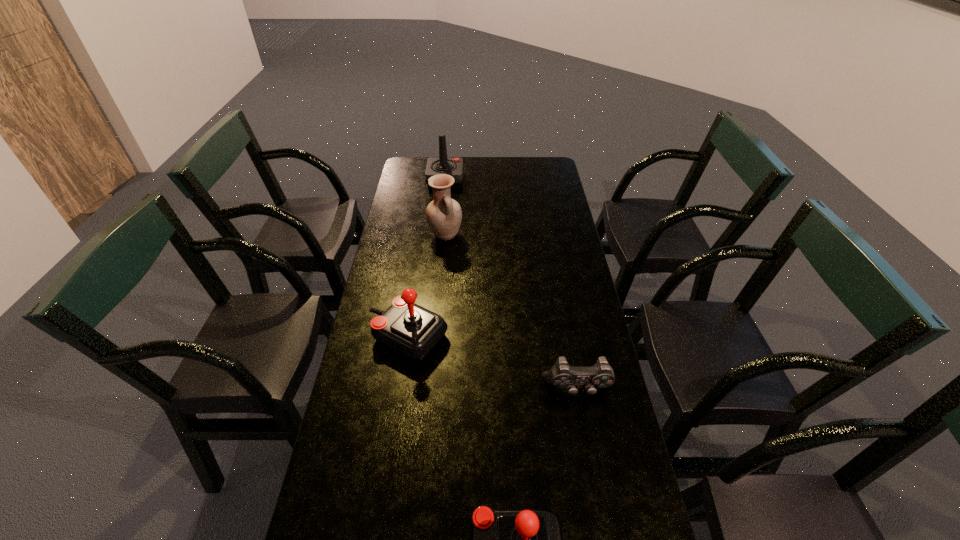
The height and width of the screenshot is (540, 960). I want to click on pottery, so point(444,215).

Where is `the farthest joystick`? the farthest joystick is located at coordinates (453, 166).

The width and height of the screenshot is (960, 540). I want to click on the second farthest joystick, so click(413, 331).

Identify the location of the shortest object. This screenshot has width=960, height=540. (562, 375).

At what (x,y) coordinates should I click in order to perform the action: click on control. Please return your answer as a coordinate pair (x, y). Looking at the image, I should click on (562, 375).

Identify the location of vacant space located 0.170m on the back of the fourth nearest object. The height and width of the screenshot is (540, 960). (448, 201).

Identify the location of free space located 0.360m on the front-facing side of the farthest joystick. (540, 180).

Image resolution: width=960 pixels, height=540 pixels. In order to click on vacant space positioned on the back of the third farthest object in this screenshot , I will do `click(420, 254)`.

Identify the location of free space located 0.080m on the surface of the shortest object with buttons. (586, 430).

Find the location of a particular element. object that is at the far edge is located at coordinates (453, 166).